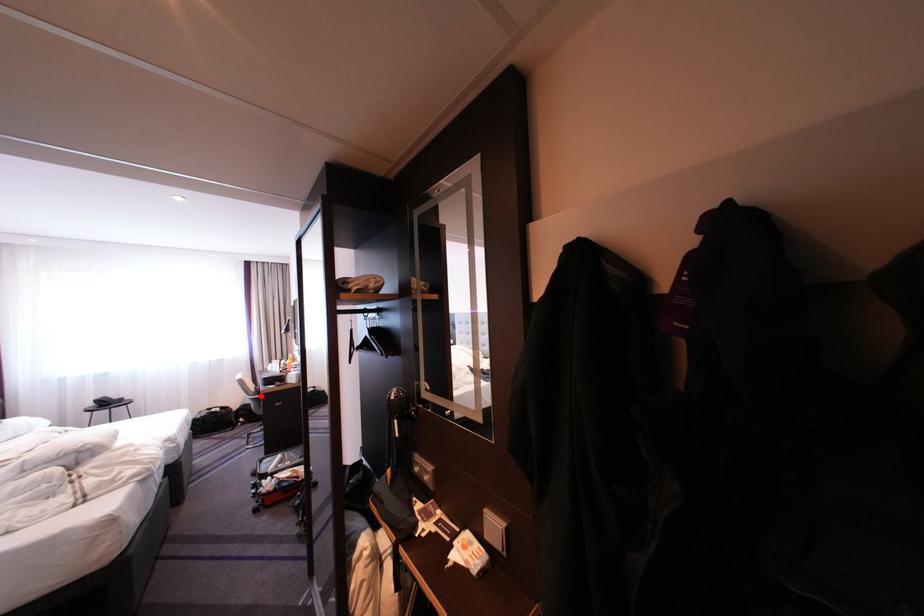
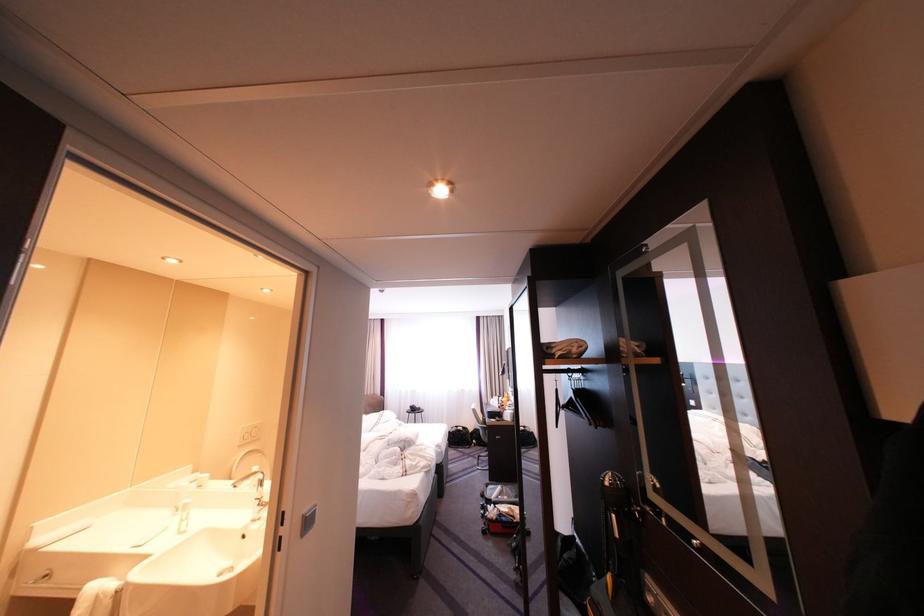
Locate, in the second image, the point that corresponds to the highlighted location in the first image.

(491, 424)